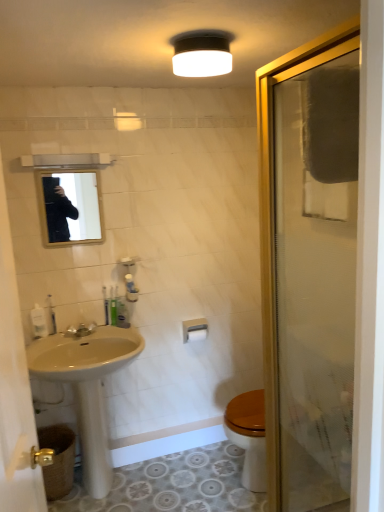
Locate an element on the screen. free area in between matte silver faucet at lower left and translucent plastic soap dispenser at lower left, which is the third toiletry from right to left is located at coordinates (54, 338).